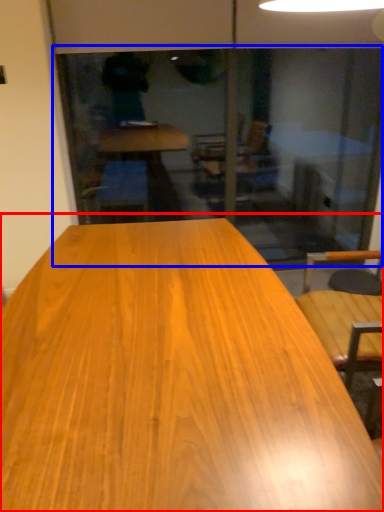
Question: Among these objects, which one is nearest to the camera, table (highlighted by a red box) or screen door (highlighted by a blue box)?

Choices:
 (A) table
 (B) screen door

Answer: (A)